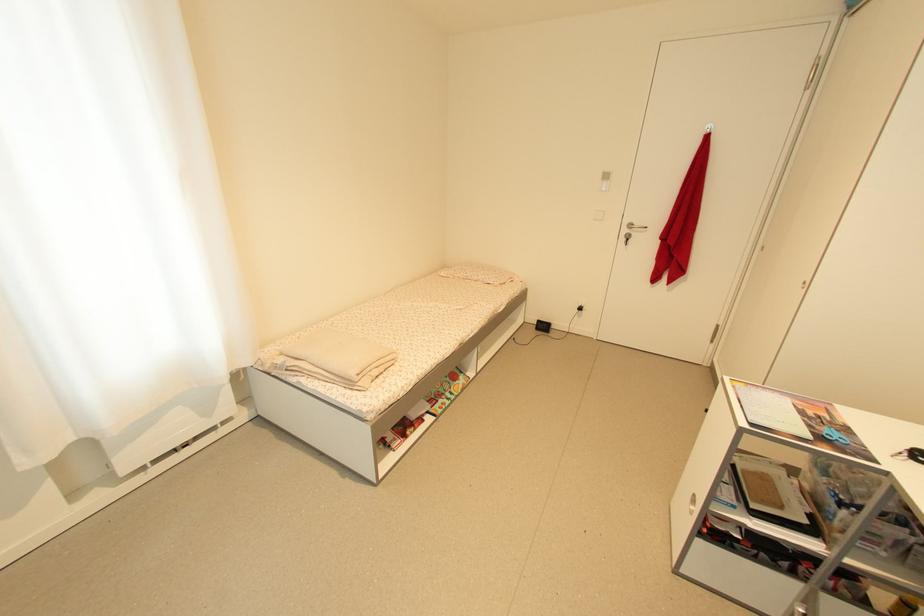
Find where to pull the key in lock. Please return your answer as a coordinate pair (x, y).

(626, 238)